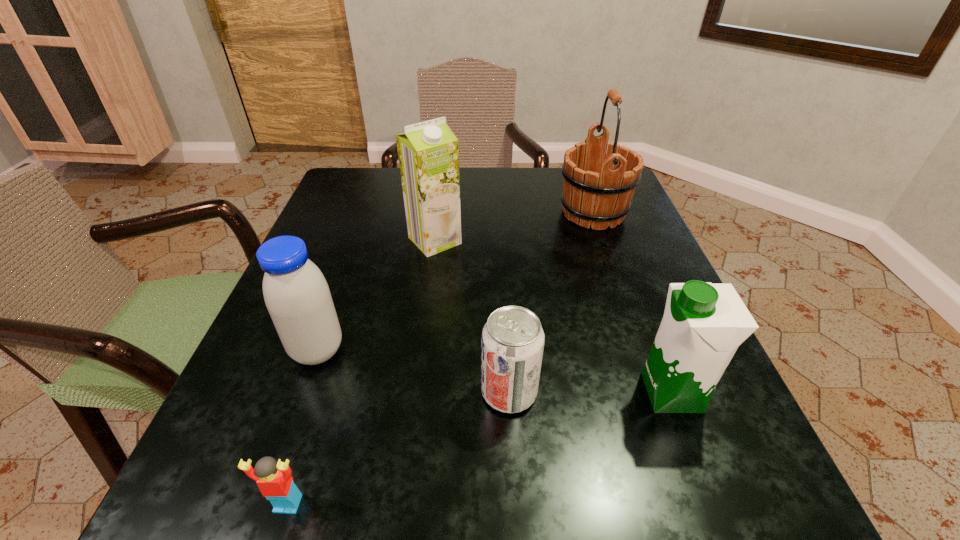
Find the location of `free point between the fourth object from right to left and the rightmost soya milk`. free point between the fourth object from right to left and the rightmost soya milk is located at coordinates (553, 316).

This screenshot has height=540, width=960. Identify the location of free point between the wine bucket and the fifth tallest object. pos(551,302).

You are a GUI agent. You are given a task and a screenshot of the screen. Output one action in this format:
    pyautogui.click(x=<x>, y=<y>)
    Task: Click on the free space between the soda can and the leftmost soya milk
    
    Given the screenshot: What is the action you would take?
    pyautogui.click(x=414, y=371)

Find the location of a particular element. vacant area that lies between the third object from left to right and the rightmost soya milk is located at coordinates (553, 316).

You are a GUI agent. You are given a task and a screenshot of the screen. Output one action in this format:
    pyautogui.click(x=<x>, y=<y>)
    Task: Click on the empty space that is in between the fifth tallest object and the wine bucket
    
    Given the screenshot: What is the action you would take?
    pyautogui.click(x=551, y=302)

Where is `free space between the rightmost soya milk and the shortest object`? free space between the rightmost soya milk and the shortest object is located at coordinates (x=480, y=448).

In order to click on empty space between the Lego and the third object from left to right in this screenshot , I will do `click(362, 372)`.

At what (x,y) coordinates should I click in order to perform the action: click on vacant space in between the Lego and the tallest soya milk. Please return your answer as a coordinate pair (x, y). The image size is (960, 540). Looking at the image, I should click on (362, 372).

Identify the location of free space between the Lego and the rightmost soya milk. tap(480, 448).

This screenshot has height=540, width=960. Identify the location of the second closest object to the rightmost soya milk. (598, 186).